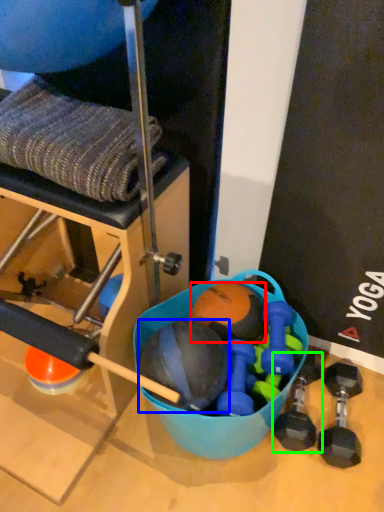
Question: Considering the real-world distances, which object is closest to ball (highlighted by a red box)? ball (highlighted by a blue box) or dumbbell (highlighted by a green box).

Choices:
 (A) ball
 (B) dumbbell

Answer: (A)